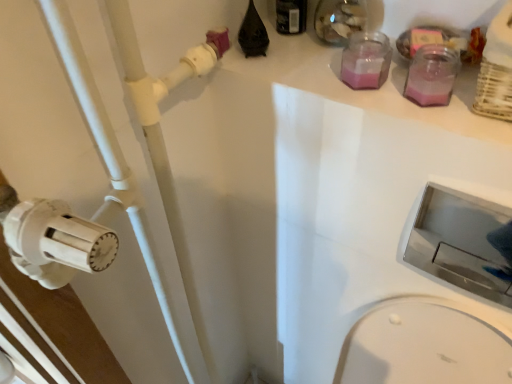
At what (x,y) coordinates should I click in order to perform the action: click on free space to the left of pink glass jar at upper right, the second bottle in the top-to-bottom sequence. Please return your answer as a coordinate pair (x, y). Looking at the image, I should click on (325, 89).